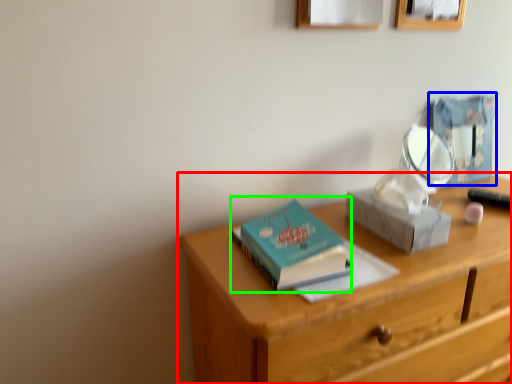
Question: Which object is the closest to the desk (highlighted by a red box)? Choose among these: box (highlighted by a blue box) or paperback book (highlighted by a green box).

Choices:
 (A) box
 (B) paperback book

Answer: (B)